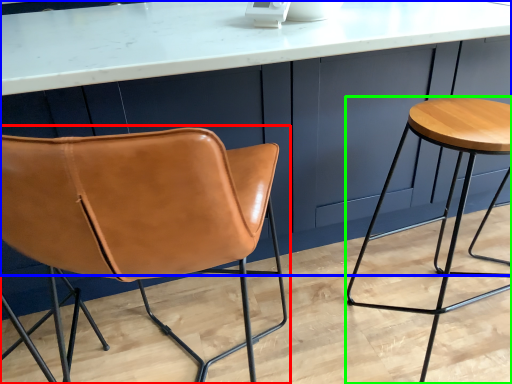
Question: Based on their relative distances, which object is nearer to chair (highlighted by a red box)? Choose from counter (highlighted by a blue box) and stool (highlighted by a green box).

Choices:
 (A) counter
 (B) stool

Answer: (A)